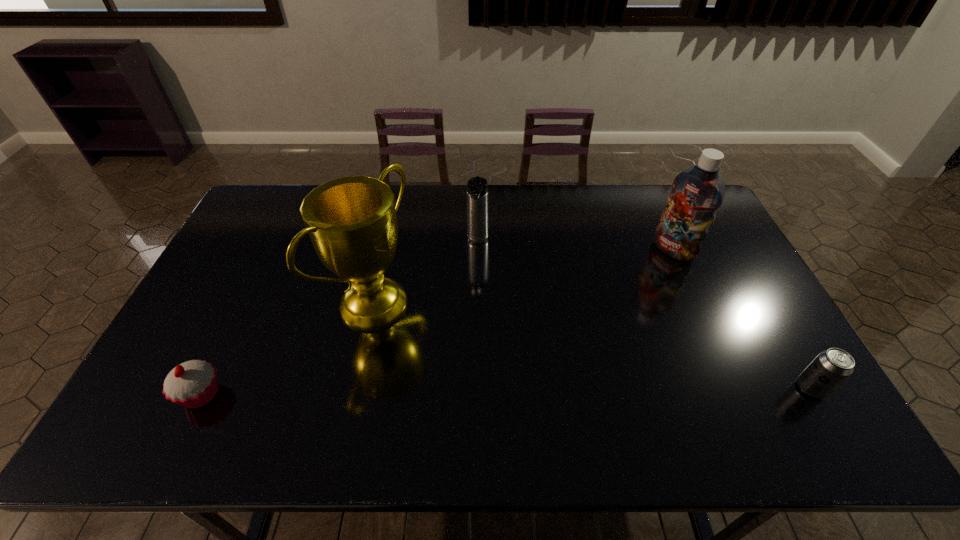
You are a GUI agent. You are given a task and a screenshot of the screen. Output one action in this format:
    pyautogui.click(x=<x>, y=<y>)
    Task: Click on the vacant region located on the front label of the fourth object from left to right
    This screenshot has height=540, width=960.
    Given the screenshot: What is the action you would take?
    pyautogui.click(x=604, y=307)

Locate an element on the screen. This screenshot has height=540, width=960. free space located on the handle side of the third object from left to right is located at coordinates (454, 332).

Locate an element on the screen. This screenshot has height=540, width=960. free space located 0.360m on the handle side of the third object from left to right is located at coordinates (452, 341).

Locate an element on the screen. Image resolution: width=960 pixels, height=540 pixels. free location located 0.070m on the handle side of the third object from left to right is located at coordinates (471, 267).

Find the location of a particular element. The image size is (960, 540). blank space located on the shiny surface of the award is located at coordinates click(451, 351).

Where is `vacant region located on the shiny surface of the award`? This screenshot has width=960, height=540. vacant region located on the shiny surface of the award is located at coordinates (492, 370).

Identify the location of vacant point located on the shiny surface of the award. The height and width of the screenshot is (540, 960). (432, 342).

Where is `cupcake that is positioned at the near edge`? The width and height of the screenshot is (960, 540). cupcake that is positioned at the near edge is located at coordinates (192, 384).

Find the location of a particular element. The width and height of the screenshot is (960, 540). beer can at the near edge is located at coordinates (831, 367).

Identify the location of object positioned at the left edge. (192, 384).